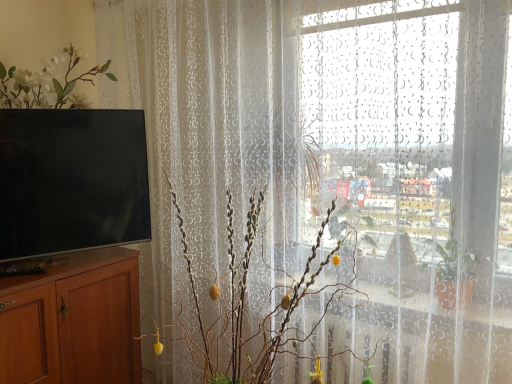
Question: In the image, is matte black tv at left positioned in front of or behind silvery metallic branches at center?

Choices:
 (A) front
 (B) behind

Answer: (B)

Question: In terms of size, does matte black tv at left appear bigger or smaller than silvery metallic branches at center?

Choices:
 (A) big
 (B) small

Answer: (B)

Question: Which of these objects is positioned farthest from the brown wood cabinet at left?

Choices:
 (A) silvery metallic branches at center
 (B) matte black tv at left

Answer: (A)

Question: Which object is the closest to the silvery metallic branches at center?

Choices:
 (A) brown wood cabinet at left
 (B) matte black tv at left

Answer: (B)